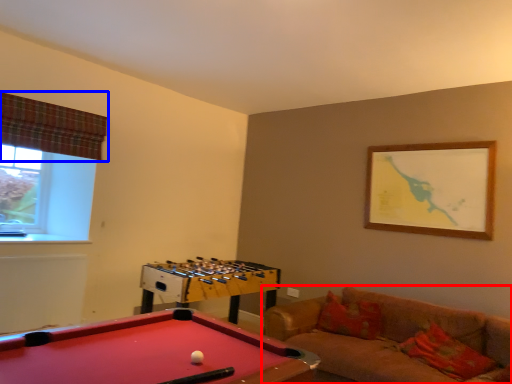
Question: Among these objects, which one is nearest to the camera, studio couch (highlighted by a red box) or curtain (highlighted by a blue box)?

Choices:
 (A) studio couch
 (B) curtain

Answer: (A)